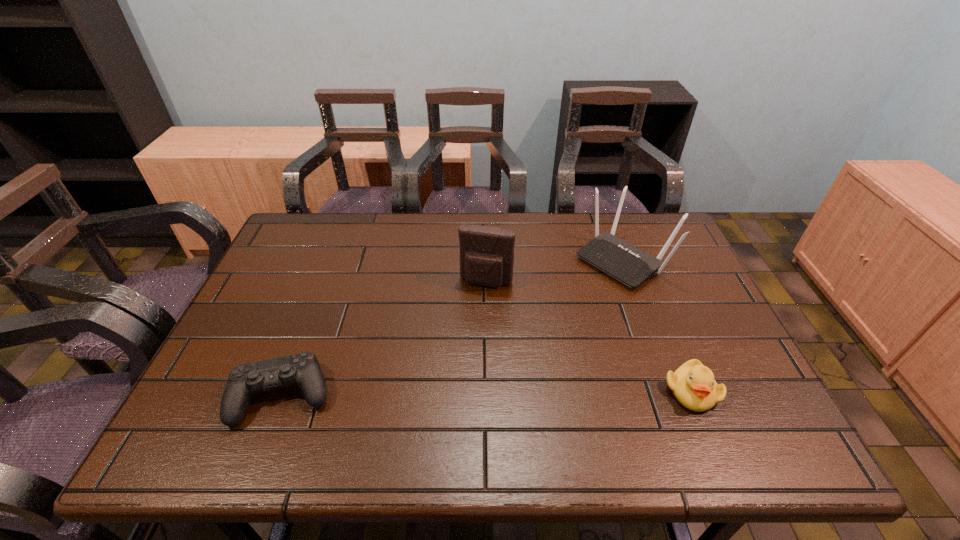
Where is `control`? This screenshot has height=540, width=960. control is located at coordinates (303, 369).

Identify the location of duckling. (693, 384).

Where is `router`? This screenshot has width=960, height=540. router is located at coordinates (630, 265).

This screenshot has width=960, height=540. In order to click on pouch in this screenshot , I will do `click(486, 253)`.

Image resolution: width=960 pixels, height=540 pixels. I want to click on vacant region located 0.260m on the right of the leftmost object, so click(447, 395).

At what (x,y) coordinates should I click in order to perform the action: click on vacant area located 0.390m on the front-facing side of the router. Please return your answer as a coordinate pair (x, y). This screenshot has width=960, height=540. Looking at the image, I should click on (496, 352).

You are a GUI agent. You are given a task and a screenshot of the screen. Output one action in this format:
    pyautogui.click(x=<x>, y=<y>)
    Task: Click on the free spot located on the front-facing side of the router
    The width and height of the screenshot is (960, 540).
    Given the screenshot: What is the action you would take?
    pyautogui.click(x=551, y=313)

Locate an element on the screen. free spot located 0.140m on the front-facing side of the router is located at coordinates (564, 303).

The width and height of the screenshot is (960, 540). I want to click on vacant space situated with an open flap on the second object from left to right, so tap(470, 328).

Locate an element on the screen. free space located with an open flap on the second object from left to right is located at coordinates (474, 316).